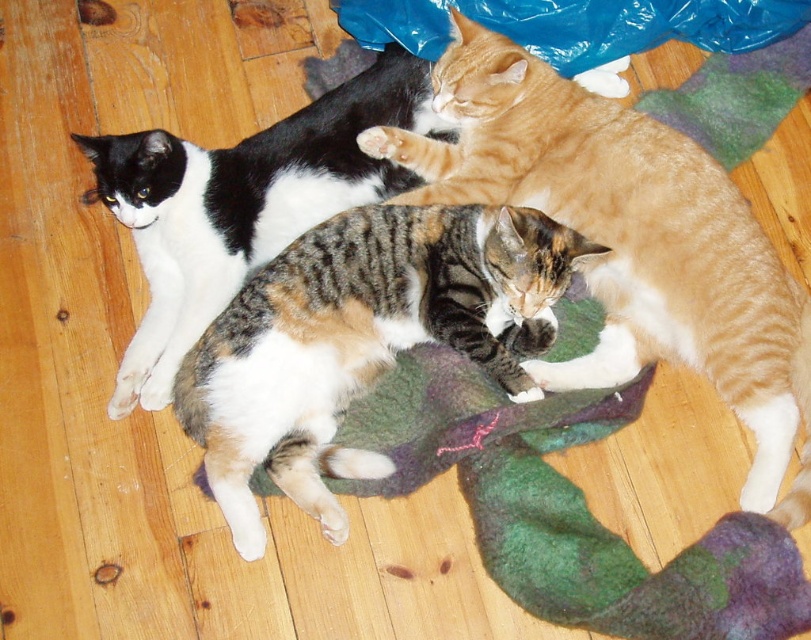
Question: Does calico fur cat at center appear under multicolored felt sock at lower right?

Choices:
 (A) no
 (B) yes

Answer: (A)

Question: Which of the following is the closest to the observer?

Choices:
 (A) multicolored felt sock at lower right
 (B) tabby fur cat at center
 (C) calico fur cat at center
 (D) black and white fur cat at upper left

Answer: (A)

Question: Which of the following is the closest to the observer?

Choices:
 (A) calico fur cat at center
 (B) black and white fur cat at upper left
 (C) multicolored felt sock at lower right
 (D) tabby fur cat at center

Answer: (C)

Question: Where is tabby fur cat at center located in relation to calico fur cat at center in the image?

Choices:
 (A) above
 (B) below

Answer: (A)

Question: Which point is farther to the camera?

Choices:
 (A) calico fur cat at center
 (B) black and white fur cat at upper left
 (C) multicolored felt sock at lower right
 (D) tabby fur cat at center

Answer: (B)

Question: Can you confirm if tabby fur cat at center is positioned below black and white fur cat at upper left?

Choices:
 (A) yes
 (B) no

Answer: (A)